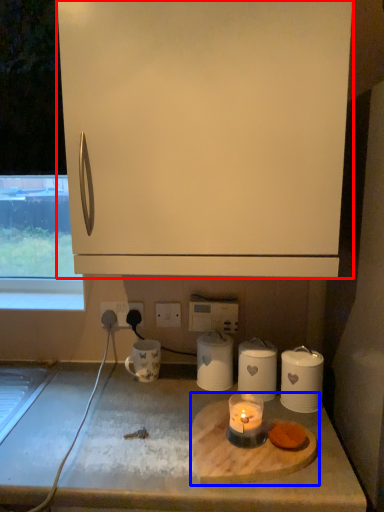
Question: Which object is closer to the camera taking this photo, cabinetry (highlighted by a red box) or appliance (highlighted by a blue box)?

Choices:
 (A) cabinetry
 (B) appliance

Answer: (A)